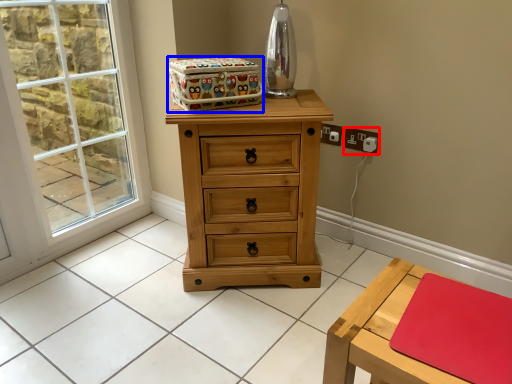
Question: Which of the following is the closest to the observer, electric outlet (highlighted by a red box) or storage box (highlighted by a blue box)?

Choices:
 (A) electric outlet
 (B) storage box

Answer: (B)